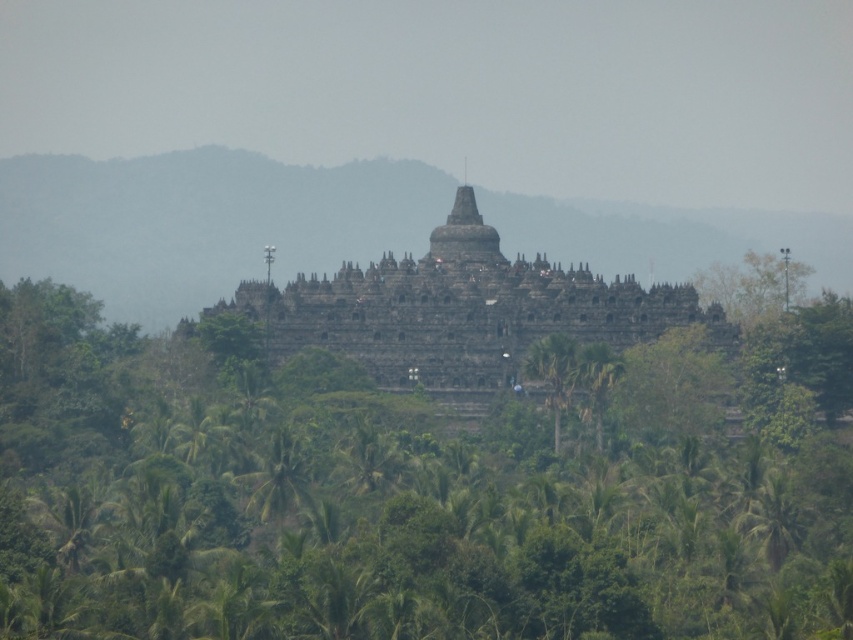
Question: Is green leafy tree at center thinner than green leafy palm tree at lower center?

Choices:
 (A) no
 (B) yes

Answer: (A)

Question: Can you confirm if green leafy tree at center is thinner than dark stone hindu temple at center?

Choices:
 (A) no
 (B) yes

Answer: (A)

Question: Estimate the real-world distances between objects in this image. Which object is closer to the dark stone hindu temple at center?

Choices:
 (A) green leafy tree at center
 (B) green leafy palm tree at lower center

Answer: (A)

Question: Which object appears closest to the camera in this image?

Choices:
 (A) green leafy tree at center
 (B) green leafy palm tree at lower center

Answer: (A)

Question: In this image, where is dark stone hindu temple at center located relative to green leafy palm tree at lower center?

Choices:
 (A) right
 (B) left

Answer: (A)

Question: Which of the following is the closest to the observer?

Choices:
 (A) (305, 333)
 (B) (55, 552)
 (C) (265, 467)

Answer: (B)